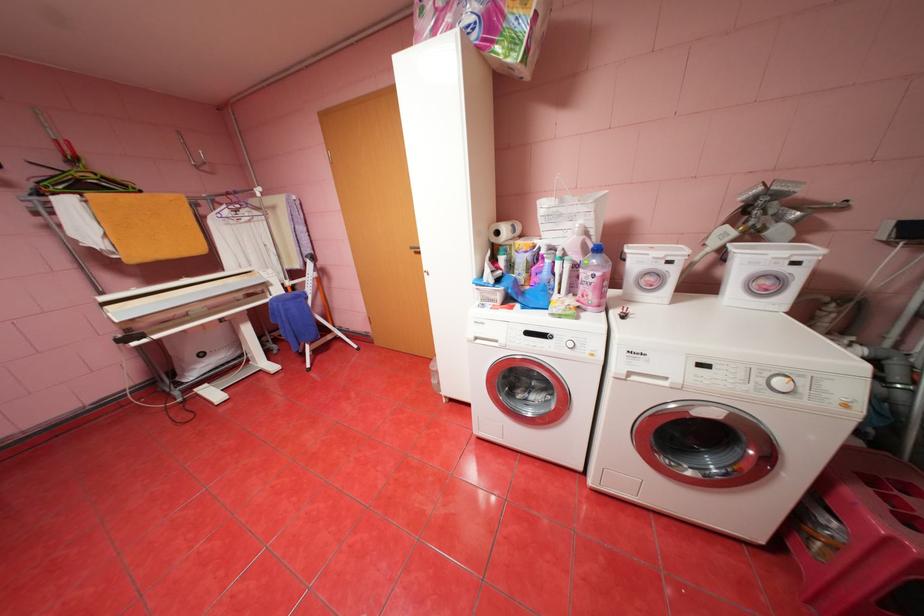
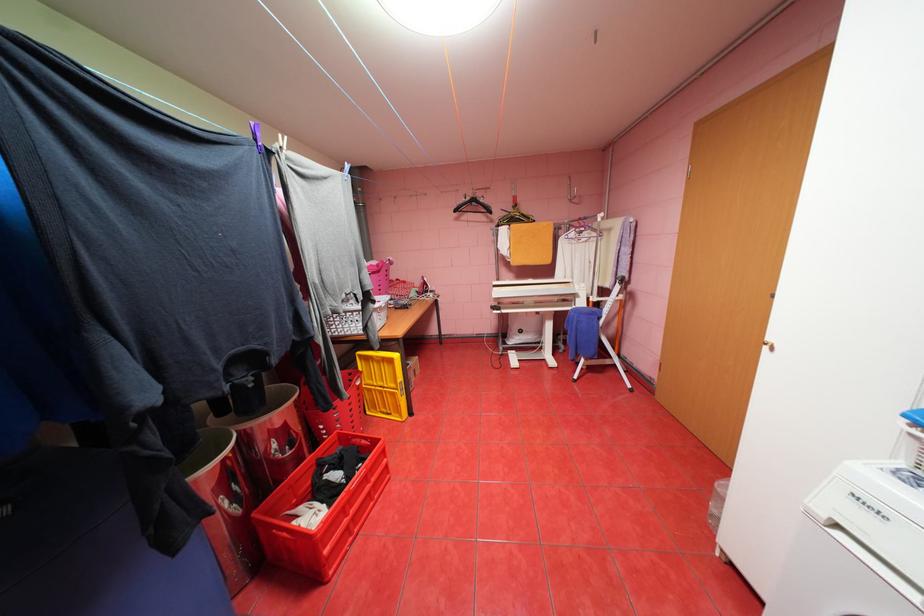
Locate, in the second image, the point that corresponds to (484,338) in the first image.

(845, 525)